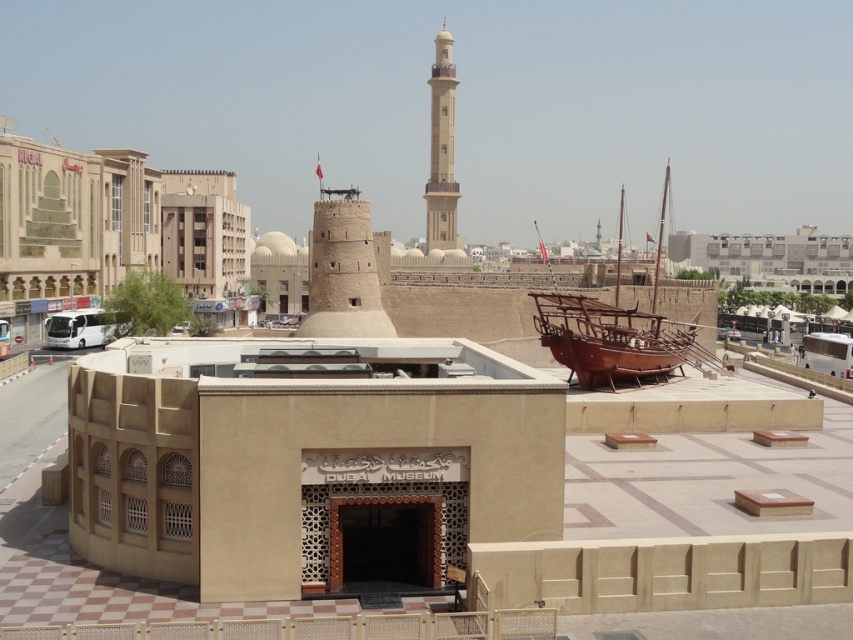
Looking at this image, is rustic wood boat at center-right further to the viewer compared to beige stone minaret at center?

That is False.

Does point (544, 342) come closer to viewer compared to point (450, 48)?

Yes, it is in front of point (450, 48).

Where is `rustic wood boat at center-right`? This screenshot has height=640, width=853. rustic wood boat at center-right is located at coordinates (616, 336).

Locate an element on the screen. This screenshot has width=853, height=640. rustic wood boat at center-right is located at coordinates (616, 336).